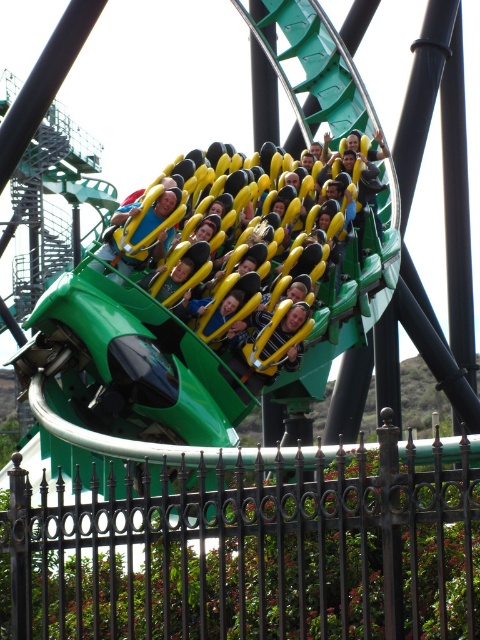
You are standing at the entrance of the amusement park and see the green matte roller coaster at center and the yellow padded seat at center. Which object is positioned to the right side?

The green matte roller coaster at center is positioned to the right of the yellow padded seat at center.

You are a park visitor who wants to take a photo of the green matte roller coaster at center and the yellow padded seat at center. Since you want to capture both in the frame, which object should you focus on first to ensure both are visible?

You should focus on the green matte roller coaster at center first because it is larger in size than the yellow padded seat at center, so it will take up more of the frame and ensure both are visible.

In the scene shown: You are standing at the entrance of the amusement park and see the green roller coaster at center. There is a point marked at coordinates (202,337). Can you tell me what this point is located on?

The point marked at coordinates (202,337) is located on the green matte roller coaster at center.